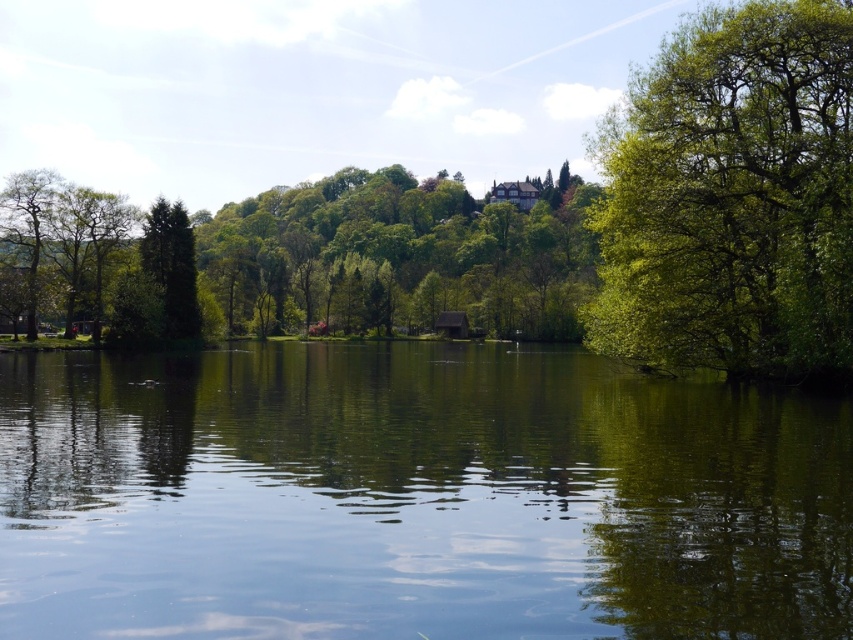
From the picture: You are standing at the lakeside and want to take a photo of both the green leafy tree at right and the green leafy tree at left. Which tree should you position closer to the camera to include both in the frame?

The green leafy tree at right is closer to the viewer than the green leafy tree at left, so you should position the camera closer to the green leafy tree at right to include both in the frame.

You are standing at the center of the lakeside and want to determine which tree is taller between the green leafy tree at right and the green leafy tree at left. Based on the scene, which one is taller?

The green leafy tree at right is much taller than the green leafy tree at left.

You are standing at the lakeside and want to compare the sizes of the green reflective water at center and the green leafy tree at right. Which one appears wider from your perspective?

The green reflective water at center appears wider than the green leafy tree at right because its width is larger according to the description.